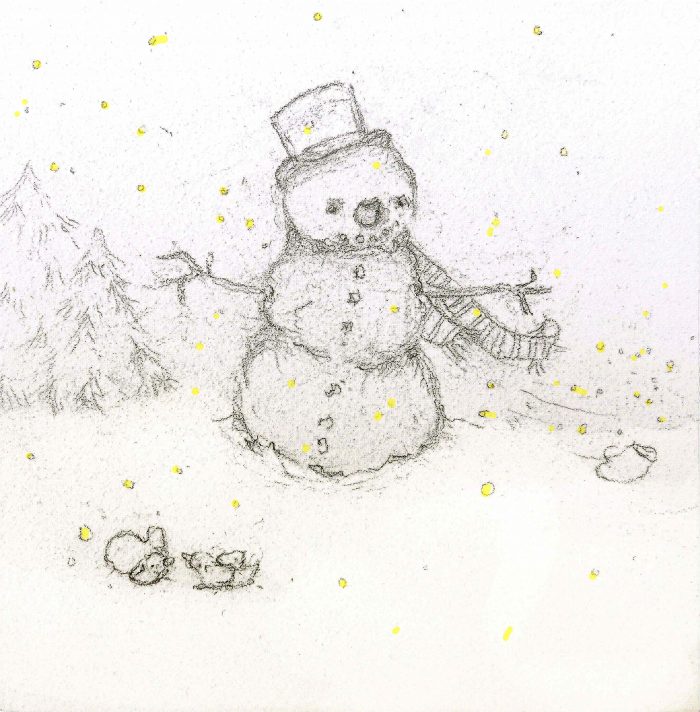
Image resolution: width=700 pixels, height=712 pixels. Identify the location of cup. (624, 476).